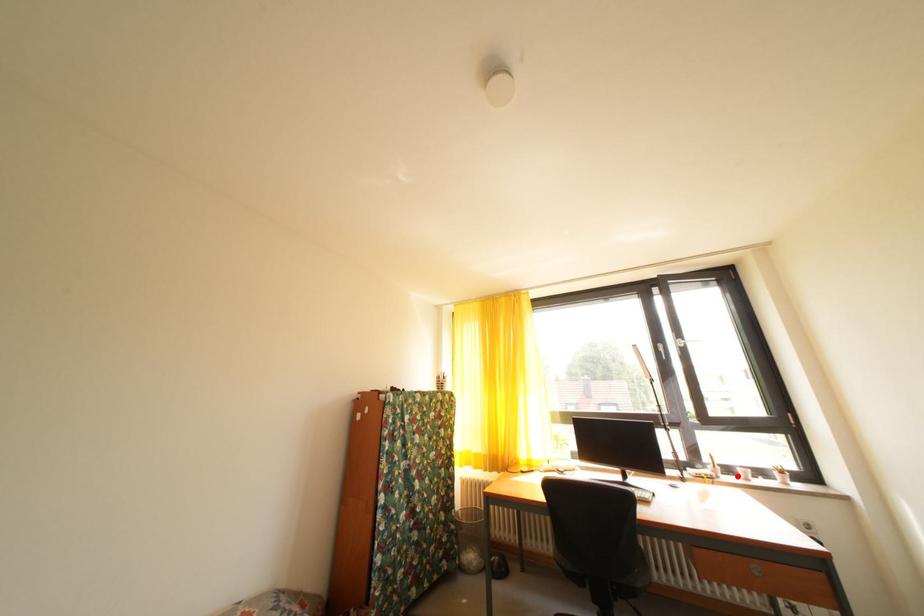
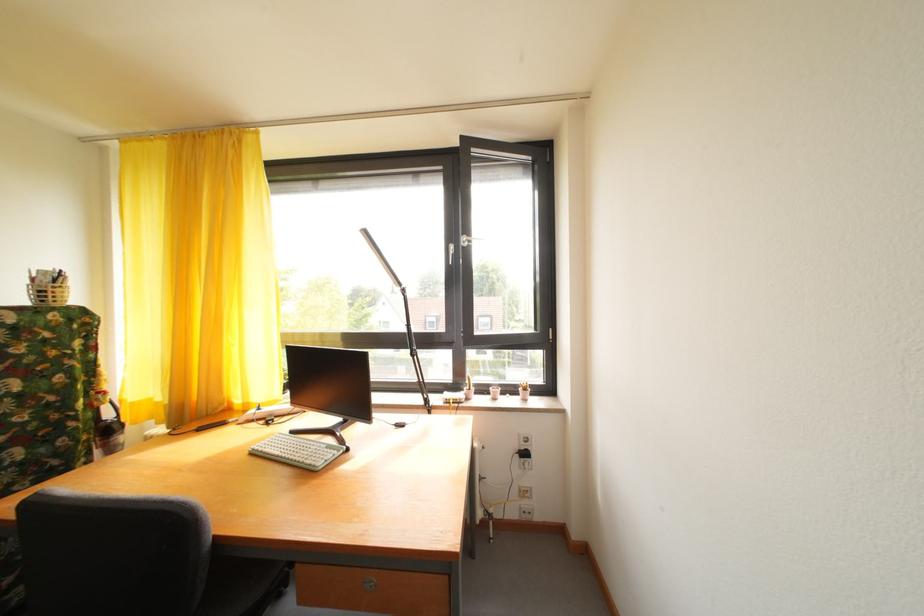
Where in the second image is the point corresponding to the highlighted location from the first image?

(492, 395)